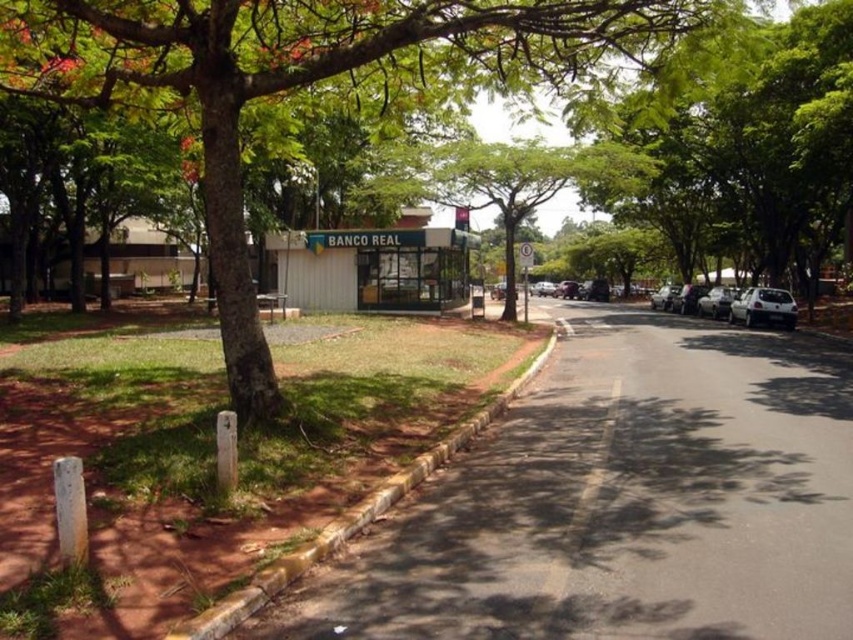
Who is positioned more to the left, green leafy tree at center or black asphalt road at center?

green leafy tree at center is more to the left.

Is green leafy tree at center smaller than black asphalt road at center?

No, green leafy tree at center is not smaller than black asphalt road at center.

Between point (343, 35) and point (572, 513), which one is positioned behind?

The point (343, 35) is behind.

This screenshot has height=640, width=853. Identify the location of green leafy tree at center. (300, 83).

Does yellow concrete curb at lower left lie behind black asphalt road at center?

No, yellow concrete curb at lower left is in front of black asphalt road at center.

Between point (396, 481) and point (552, 611), which one is positioned in front?

Point (552, 611) is more forward.

Identify the location of yellow concrete curb at lower left. Image resolution: width=853 pixels, height=640 pixels. (347, 518).

Does green leafy tree at center appear over white matte car at right?

Indeed, green leafy tree at center is positioned over white matte car at right.

Is green leafy tree at center behind white matte car at right?

No, green leafy tree at center is closer to the viewer.

This screenshot has height=640, width=853. Describe the element at coordinates (300, 83) in the screenshot. I see `green leafy tree at center` at that location.

Identify the location of green leafy tree at center. This screenshot has width=853, height=640. (300, 83).